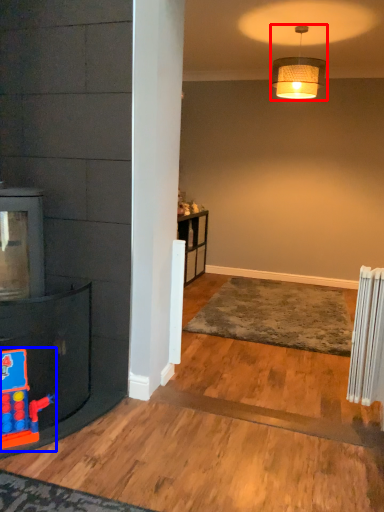
Question: Which object is further to the camera taking this photo, lamp (highlighted by a red box) or toy (highlighted by a blue box)?

Choices:
 (A) lamp
 (B) toy

Answer: (A)